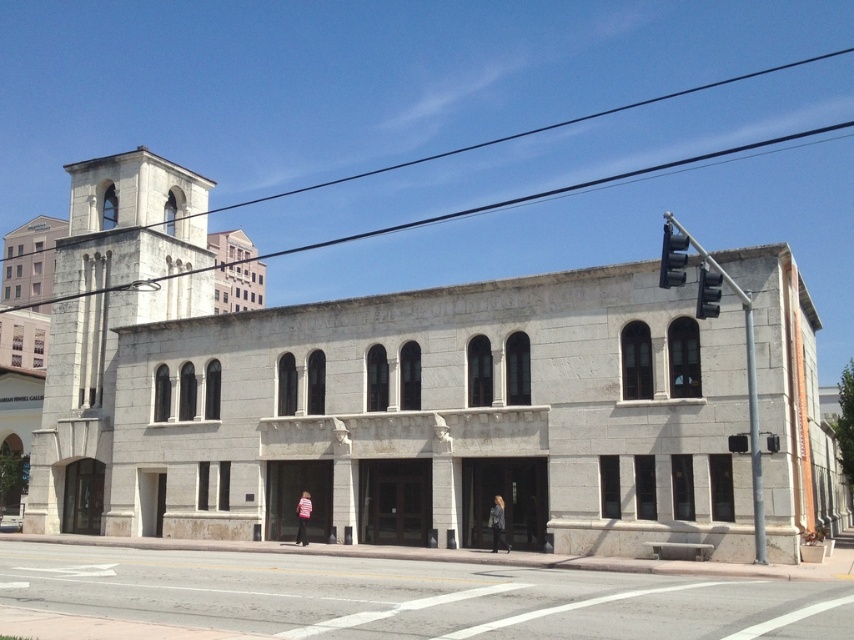
Which is above, gray concrete road at lower center or white stone tower at left?

white stone tower at left is higher up.

Consider the image. Measure the distance between point (156, 554) and camera.

Point (156, 554) is 38.44 meters away from camera.

You are a GUI agent. You are given a task and a screenshot of the screen. Output one action in this format:
    pyautogui.click(x=<x>, y=<y>)
    Task: Click on the gray concrete road at lower center
    The width and height of the screenshot is (854, 640).
    Given the screenshot: What is the action you would take?
    pyautogui.click(x=412, y=596)

Where is `gray concrete road at lower center`? gray concrete road at lower center is located at coordinates (412, 596).

Is gray stone church at center wider than white stone tower at left?

Correct, the width of gray stone church at center exceeds that of white stone tower at left.

I want to click on gray stone church at center, so click(378, 397).

Where is `gray stone church at center`? The image size is (854, 640). gray stone church at center is located at coordinates (378, 397).

In the scene shown: Is gray stone church at center bigger than gray concrete road at lower center?

Yes, gray stone church at center is bigger than gray concrete road at lower center.

At what (x,y) coordinates should I click in order to perform the action: click on gray stone church at center. Please return your answer as a coordinate pair (x, y). The image size is (854, 640). Looking at the image, I should click on (378, 397).